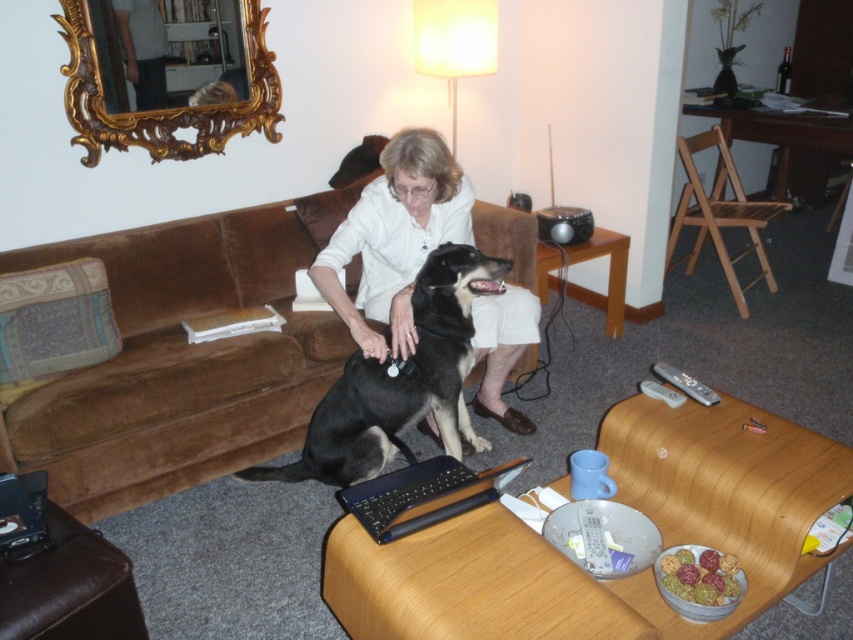
Question: Does brown velvety couch at center lie behind gold ornate mirror at upper left?

Choices:
 (A) no
 (B) yes

Answer: (A)

Question: Which point is farther to the camera?

Choices:
 (A) brown velvety couch at center
 (B) gold ornate mirror at upper left
 (C) white matte shirt at center

Answer: (B)

Question: Does white matte shirt at center have a greater width compared to black plastic laptop at center?

Choices:
 (A) no
 (B) yes

Answer: (B)

Question: Which object is farther from the camera taking this photo?

Choices:
 (A) white matte shirt at center
 (B) black plastic laptop at center
 (C) black smooth dog at center

Answer: (A)

Question: Which point is closer to the camera taking this photo?

Choices:
 (A) (268, 128)
 (B) (30, 266)

Answer: (B)

Question: Is black smooth dog at center above gold ornate mirror at upper left?

Choices:
 (A) no
 (B) yes

Answer: (A)